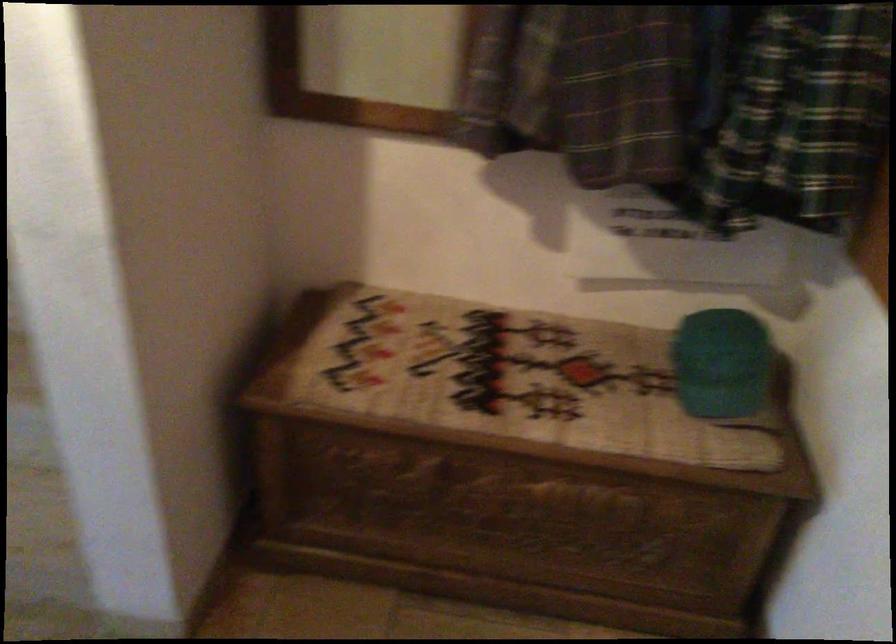
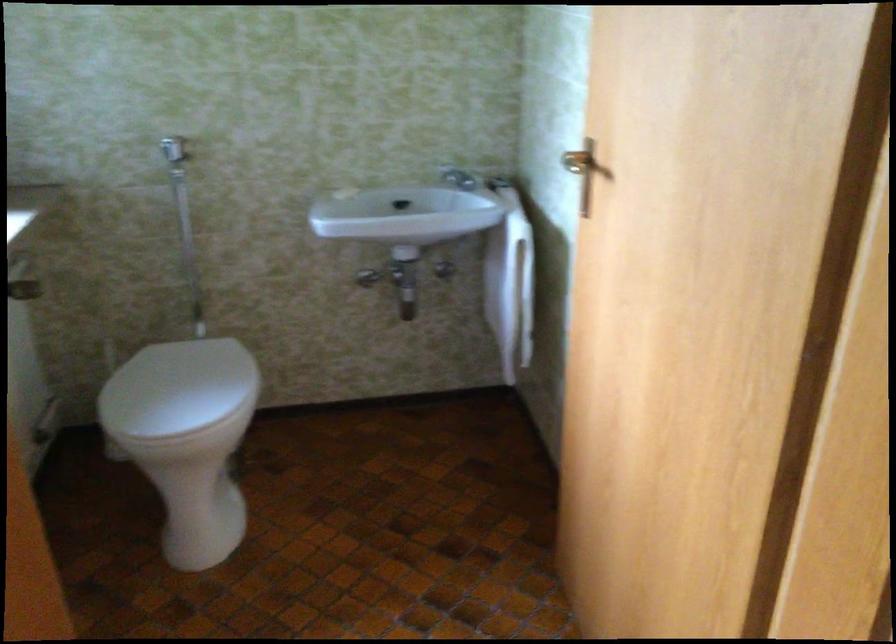
Question: Which direction would the cameraman need to move to produce the second image? Reply with the corresponding letter.

Choices:
 (A) Left
 (B) Right
 (C) Forward
 (D) Backward

Answer: (A)